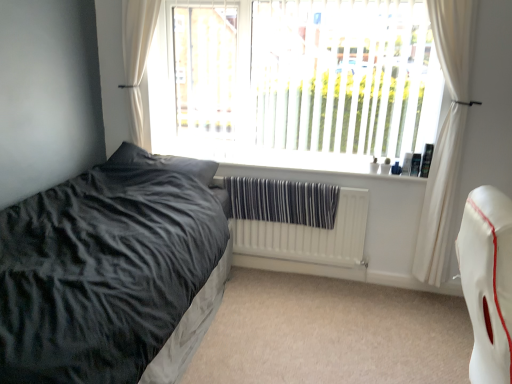
Question: Does white textured radiator at center appear on the left side of white fabric curtain at upper left, the second curtain viewed from the right?

Choices:
 (A) yes
 (B) no

Answer: (B)

Question: From a real-world perspective, is white textured radiator at center located higher than white fabric curtain at upper left, the 1th curtain when ordered from left to right?

Choices:
 (A) no
 (B) yes

Answer: (A)

Question: From the image's perspective, does white textured radiator at center appear lower than white fabric curtain at upper left, the 1th curtain when ordered from left to right?

Choices:
 (A) no
 (B) yes

Answer: (B)

Question: Does white textured radiator at center have a larger size compared to white fabric curtain at upper left, the 1th curtain when ordered from left to right?

Choices:
 (A) no
 (B) yes

Answer: (A)

Question: Is white textured radiator at center oriented away from white fabric curtain at upper left, the 1th curtain when ordered from left to right?

Choices:
 (A) yes
 (B) no

Answer: (B)

Question: Is white textured radiator at center taller than white fabric curtain at upper left, the 1th curtain when ordered from left to right?

Choices:
 (A) yes
 (B) no

Answer: (B)

Question: Does white leather swivel chair at right have a smaller size compared to white plastic window at upper center?

Choices:
 (A) no
 (B) yes

Answer: (B)

Question: Is white leather swivel chair at right at the left side of white plastic window at upper center?

Choices:
 (A) no
 (B) yes

Answer: (A)

Question: From a real-world perspective, is white leather swivel chair at right under white plastic window at upper center?

Choices:
 (A) yes
 (B) no

Answer: (A)

Question: Can you confirm if white leather swivel chair at right is shorter than white plastic window at upper center?

Choices:
 (A) no
 (B) yes

Answer: (B)

Question: Does white leather swivel chair at right turn towards white plastic window at upper center?

Choices:
 (A) yes
 (B) no

Answer: (B)

Question: Considering the relative sizes of white leather swivel chair at right and white plastic window at upper center in the image provided, is white leather swivel chair at right bigger than white plastic window at upper center?

Choices:
 (A) yes
 (B) no

Answer: (B)

Question: Is white fabric curtain at upper left, the 1th curtain when ordered from left to right, far from dark grey plush pillow at left?

Choices:
 (A) no
 (B) yes

Answer: (A)